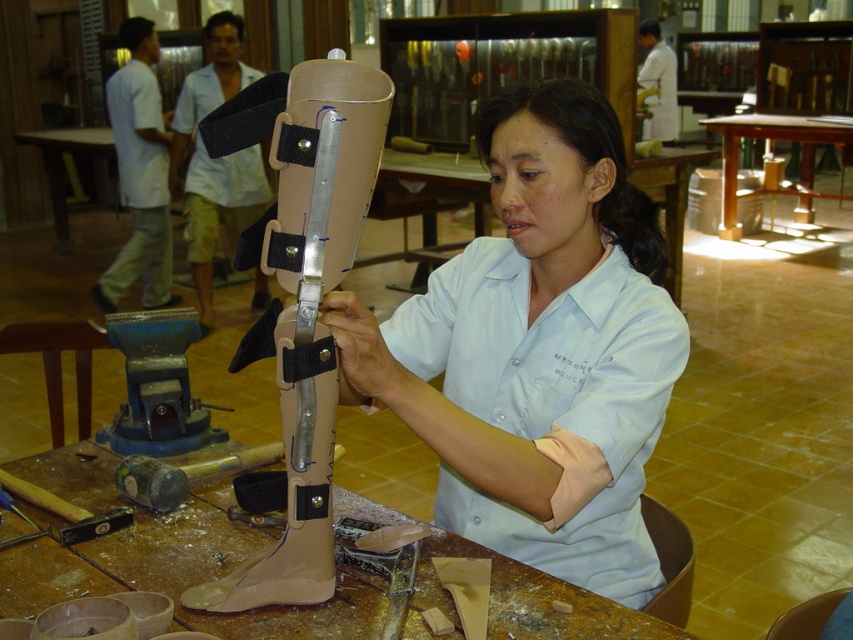
You are a prosthetic technician working in the workshop. You need to place the matte beige prosthetic leg at center onto the wooden table at center for adjustments. Is the prosthetic leg shorter than the table?

The matte beige prosthetic leg at center has a lesser height compared to wooden table at center, so yes, the prosthetic leg is shorter than the table.

You are a prosthetic technician working in the workshop. You need to place the tan matte prosthetic leg at center onto the wooden table at center. Can you determine if the prosthetic leg will fit on the table based on their sizes?

The tan matte prosthetic leg at center is smaller than the wooden table at center, so it will fit on the table.